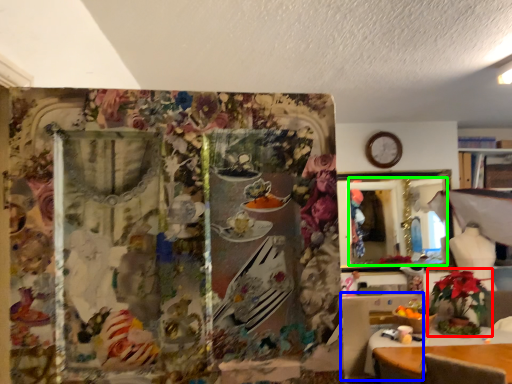
Question: Which is farther away from houseplant (highlighted by a red box)? table (highlighted by a blue box) or mirror (highlighted by a green box)?

Choices:
 (A) table
 (B) mirror

Answer: (B)